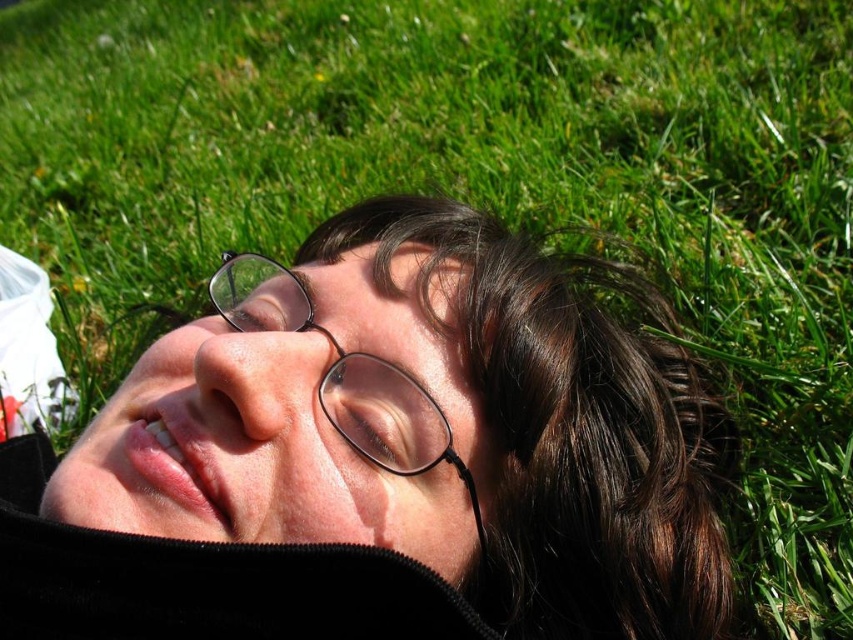
Does matte black glasses at center have a smaller size compared to clear plastic glasses at center?

Actually, matte black glasses at center might be larger than clear plastic glasses at center.

Is matte black glasses at center closer to the viewer compared to clear plastic glasses at center?

Yes, matte black glasses at center is in front of clear plastic glasses at center.

Who is more distant from viewer, (418, 211) or (241, 257)?

Point (418, 211)

Where is `matte black glasses at center`? The image size is (853, 640). matte black glasses at center is located at coordinates (432, 426).